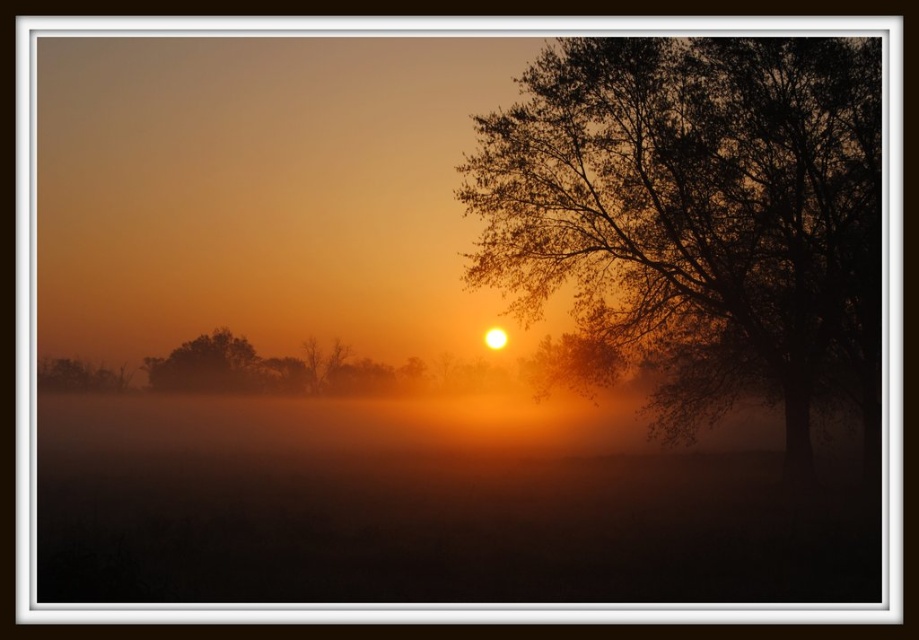
You are an astronomer observing the sunrise and want to determine the position of the silhouette leafy tree at right relative to the sun. Based on the scene, can you tell if the tree is to the east or west of the sun?

The silhouette leafy tree at right is located at point (699, 216), which places it to the west of the sun since the sun is positioned slightly off center towards the left in the scene.